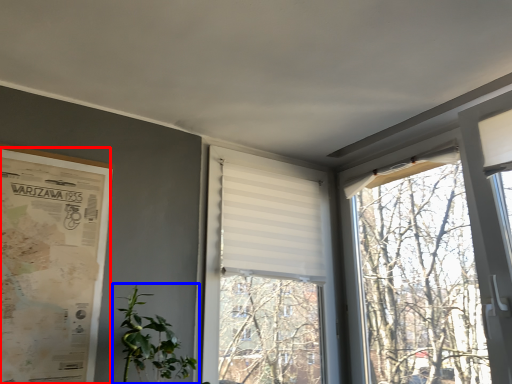
Question: Which point is closer to the camera, poster page (highlighted by a red box) or houseplant (highlighted by a blue box)?

Choices:
 (A) poster page
 (B) houseplant

Answer: (A)